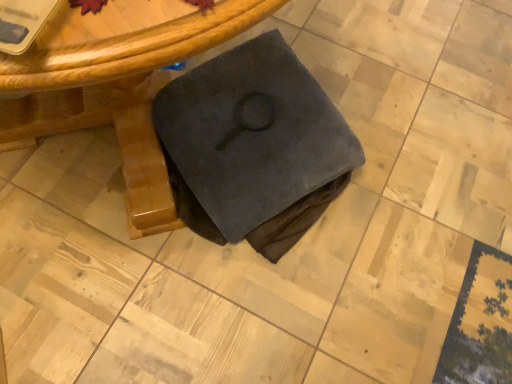
The height and width of the screenshot is (384, 512). I want to click on free space to the back side of dark suede book at center, so click(x=344, y=45).